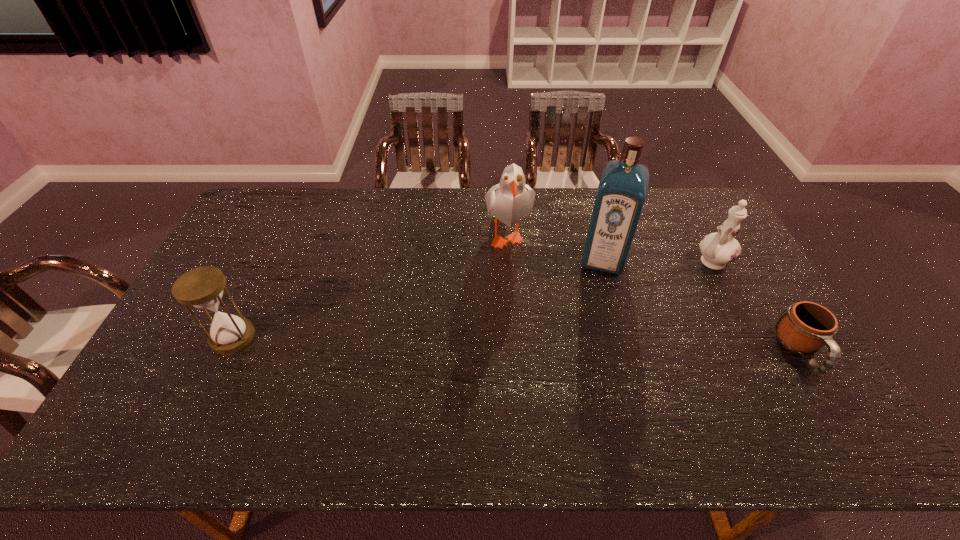
I want to click on empty space that is in between the liquor and the chinaware, so click(x=657, y=260).

The height and width of the screenshot is (540, 960). What are the coordinates of `vacant area between the gull and the leftmost object` in the screenshot? It's located at (370, 285).

Image resolution: width=960 pixels, height=540 pixels. Identify the location of vacant space that is in between the mug and the hourglass. (516, 344).

Identify the location of blank region between the chinaware and the mug. (756, 306).

Locate an element on the screen. The image size is (960, 540). vacant region between the liquor and the shortest object is located at coordinates (702, 305).

I want to click on vacant area that lies between the tallest object and the mug, so click(x=702, y=305).

Where is `empty space between the gull and the mug`? empty space between the gull and the mug is located at coordinates (654, 292).

The height and width of the screenshot is (540, 960). I want to click on free space between the hourglass and the shortest object, so click(x=516, y=344).

The image size is (960, 540). In order to click on empty space between the leftmost object and the liquor in this screenshot , I will do `click(418, 298)`.

Point out which object is positioned as the fourth nearest to the third object from left to right. Please provide its 2D coordinates. Your answer should be formatted as a tuple, i.e. [(x, y)], where the tuple contains the x and y coordinates of a point satisfying the conditions above.

[(202, 287)]